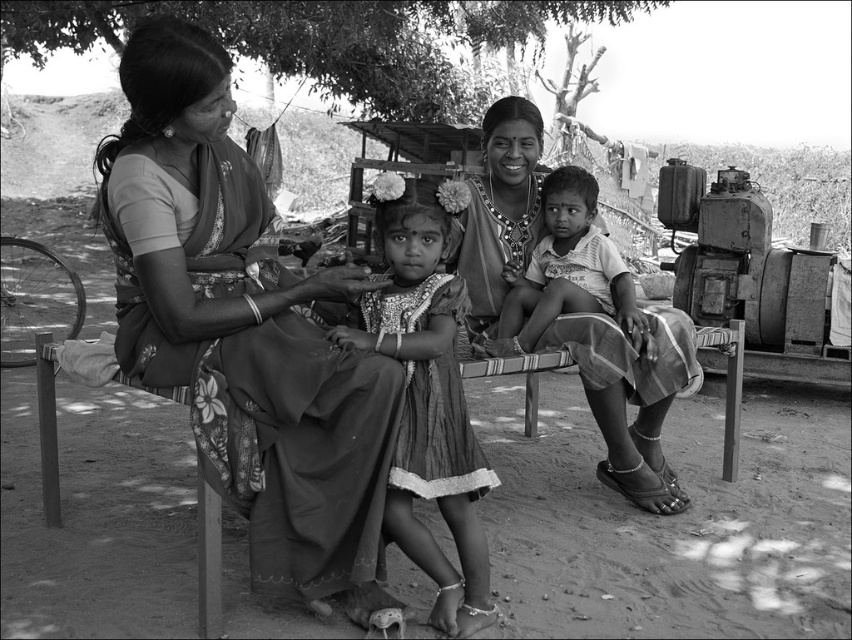
You are a photographer trying to capture a closeup shot of the textured fabric dress at center and the smooth fabric child at center. Which object should you focus on first if you want to ensure both are in focus without adjusting the camera settings?

The textured fabric dress at center has a lesser width compared to smooth fabric child at center, so you should focus on the smooth fabric child at center first to ensure both are in focus.